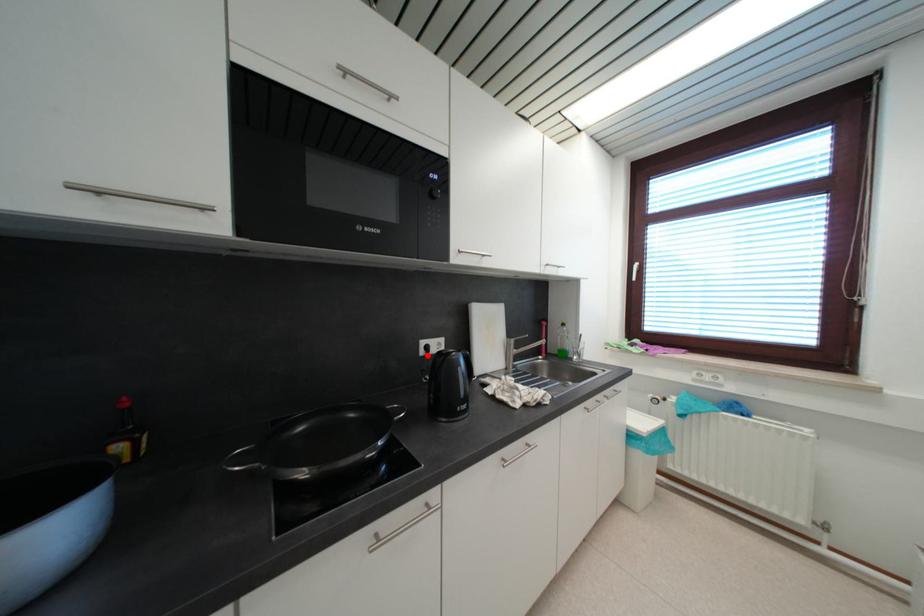
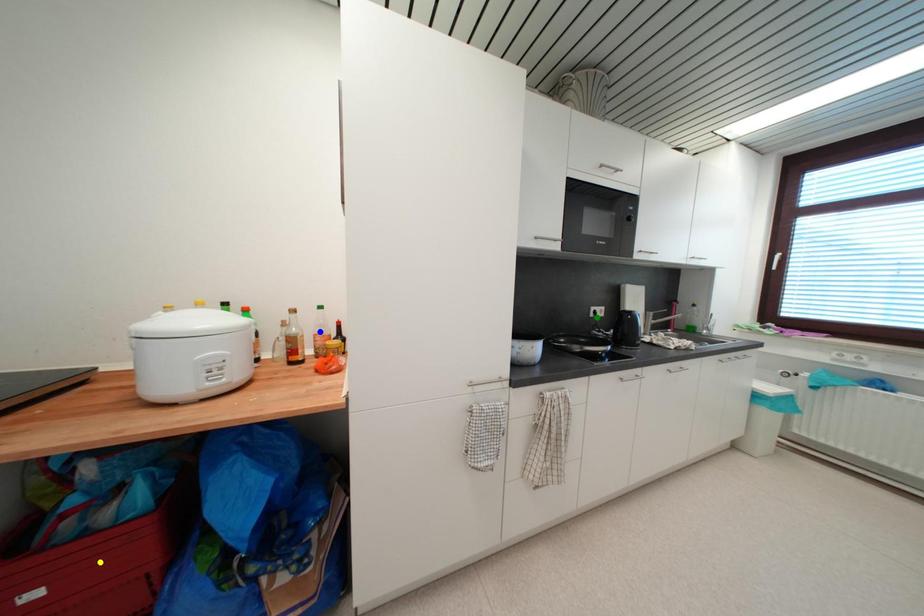
Question: I am providing you with two images of the same scene from different viewpoints. A red point is marked on the first image. You are given multiple points on the second image. In image 2, which mark is for the same physical point as the one in image 1?

Choices:
 (A) blue point
 (B) green point
 (C) yellow point

Answer: (B)